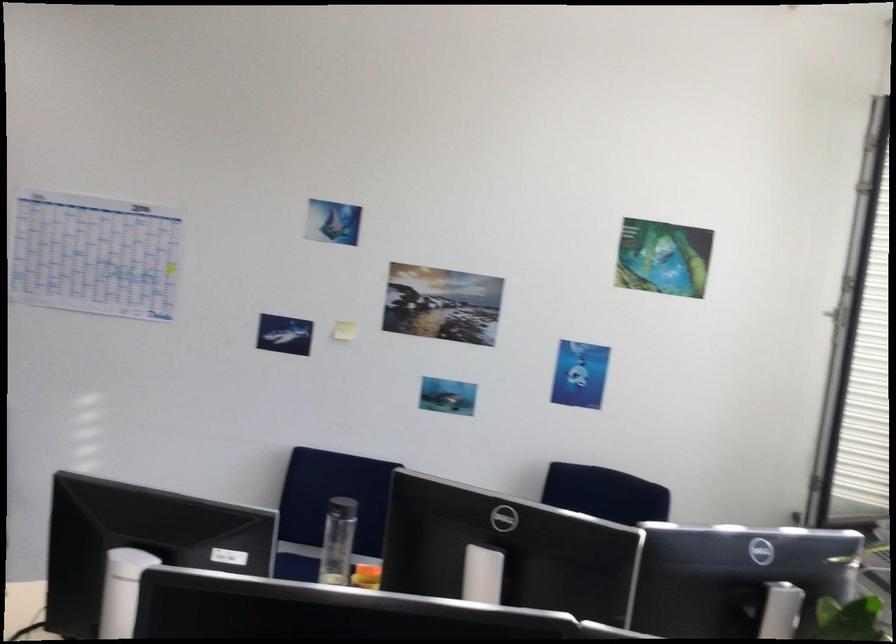
The image size is (896, 644). In order to click on window blind wand in this screenshot , I will do `click(857, 357)`.